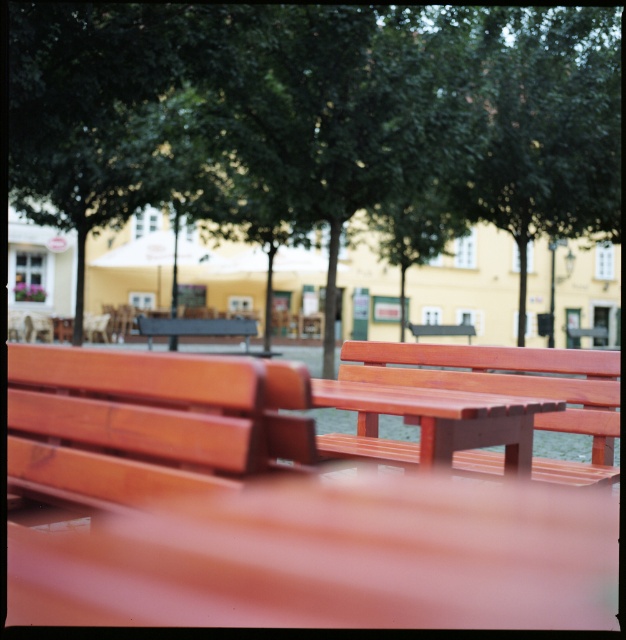
Question: Is green leafy tree at center in front of wooden table at center?

Choices:
 (A) yes
 (B) no

Answer: (B)

Question: From the image, what is the correct spatial relationship of green leafy tree at center in relation to matte wood bench at center?

Choices:
 (A) above
 (B) below

Answer: (A)

Question: Which object is farther from the camera taking this photo?

Choices:
 (A) matte wood bench at center
 (B) matte black bench at center
 (C) wooden table at center
 (D) green leafy tree at center

Answer: (B)

Question: Does matte wood bench at center have a larger size compared to wooden table at center?

Choices:
 (A) no
 (B) yes

Answer: (A)

Question: Which of the following is the closest to the observer?

Choices:
 (A) (198, 440)
 (B) (423, 449)

Answer: (A)

Question: Among these points, which one is nearest to the camera?

Choices:
 (A) (525, 467)
 (B) (203, 317)
 (C) (131, 456)
 (D) (302, 72)

Answer: (C)